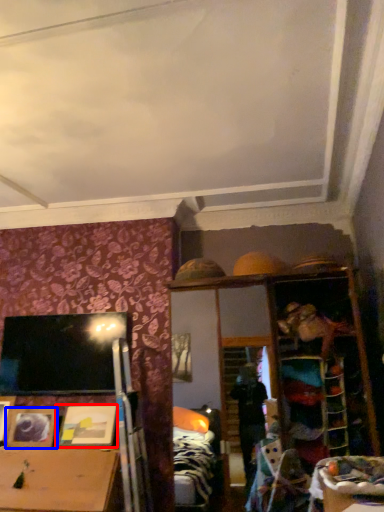
Question: Which object appears closest to the camera in this image, picture frame (highlighted by a red box) or picture frame (highlighted by a blue box)?

Choices:
 (A) picture frame
 (B) picture frame

Answer: (A)